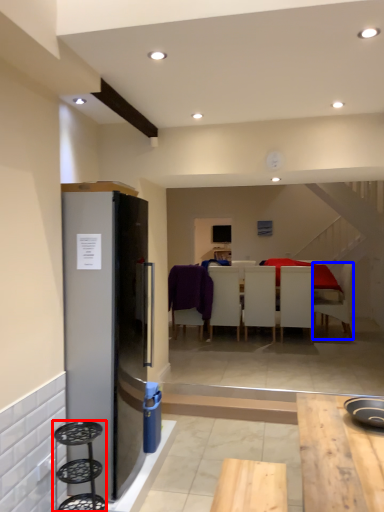
Question: Which object is closer to the camera taking this photo, bar stool (highlighted by a red box) or chair (highlighted by a blue box)?

Choices:
 (A) bar stool
 (B) chair

Answer: (A)